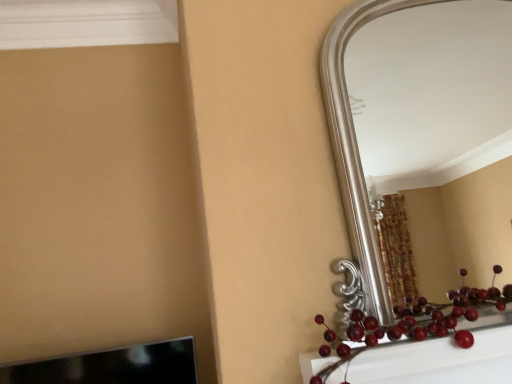
Question: Can you confirm if glossy red berries at lower right is positioned to the right of silver metallic mirror at upper right?

Choices:
 (A) yes
 (B) no

Answer: (B)

Question: From the image's perspective, would you say glossy red berries at lower right is shown under silver metallic mirror at upper right?

Choices:
 (A) yes
 (B) no

Answer: (A)

Question: Does glossy red berries at lower right lie behind silver metallic mirror at upper right?

Choices:
 (A) yes
 (B) no

Answer: (B)

Question: Is glossy red berries at lower right shorter than silver metallic mirror at upper right?

Choices:
 (A) no
 (B) yes

Answer: (B)

Question: Is glossy red berries at lower right surrounding silver metallic mirror at upper right?

Choices:
 (A) yes
 (B) no

Answer: (B)

Question: Does glossy red berries at lower right have a greater height compared to silver metallic mirror at upper right?

Choices:
 (A) no
 (B) yes

Answer: (A)

Question: From a real-world perspective, is silver metallic mirror at upper right under glossy red berries at lower right?

Choices:
 (A) no
 (B) yes

Answer: (A)

Question: Does silver metallic mirror at upper right have a lesser width compared to glossy red berries at lower right?

Choices:
 (A) no
 (B) yes

Answer: (B)

Question: Is silver metallic mirror at upper right bigger than glossy red berries at lower right?

Choices:
 (A) no
 (B) yes

Answer: (B)

Question: Is the surface of silver metallic mirror at upper right in direct contact with glossy red berries at lower right?

Choices:
 (A) no
 (B) yes

Answer: (A)

Question: From the image's perspective, would you say silver metallic mirror at upper right is positioned over glossy red berries at lower right?

Choices:
 (A) yes
 (B) no

Answer: (A)

Question: Can you confirm if silver metallic mirror at upper right is positioned to the left of glossy red berries at lower right?

Choices:
 (A) yes
 (B) no

Answer: (B)

Question: From the image's perspective, relative to glossy red berries at lower right, is silver metallic mirror at upper right above or below?

Choices:
 (A) above
 (B) below

Answer: (A)